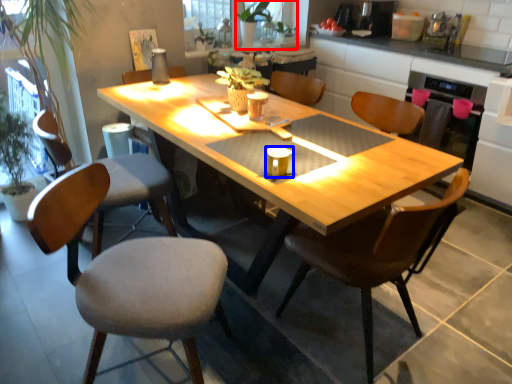
Question: Among these objects, which one is nearest to the camera, houseplant (highlighted by a red box) or coffee cup (highlighted by a blue box)?

Choices:
 (A) houseplant
 (B) coffee cup

Answer: (B)